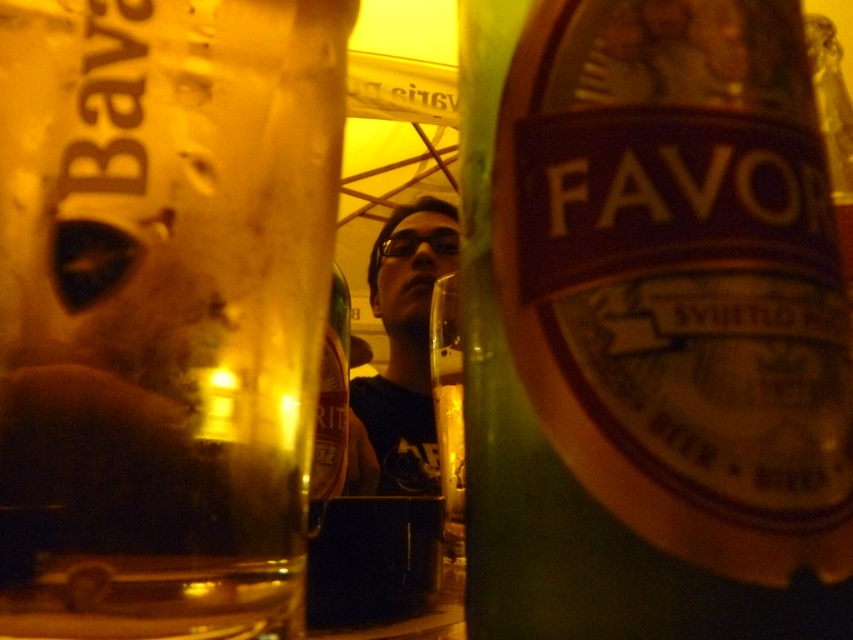
You are a bartender preparing a drink and need to choose between the green glass bottle at center right and the matte black shirt at center. Which object is narrower in width?

The green glass bottle at center right is thinner than the matte black shirt at center, so it is narrower in width.

You are a bartender who needs to place a coaster between the translucent amber glass at left and the shiny gold bottle at center to prevent spills. The coaster has a diameter of 5 inches. Is there enough space to fit it between them?

The distance between the translucent amber glass at left and the shiny gold bottle at center is 4.59 inches. Since the coaster requires 5 inches of space, it won not fit between them.

You are at the point marked as point (164, 216) and want to reach the exit located at the opposite side of the room. The shortest path requires moving in a straight line. Given that the maximum distance you can travel is 5 inches, will you be able to reach the exit?

Since the distance between you and the exit is 4.77 inches, which is within your maximum travel distance of 5 inches, you will be able to reach the exit.